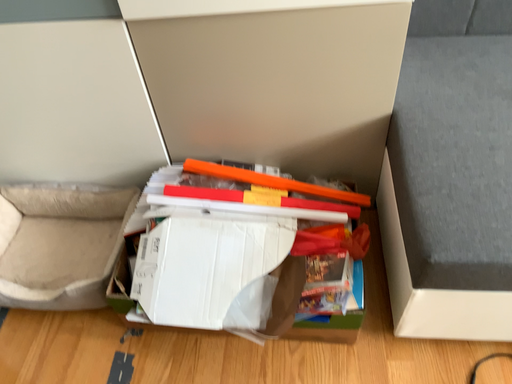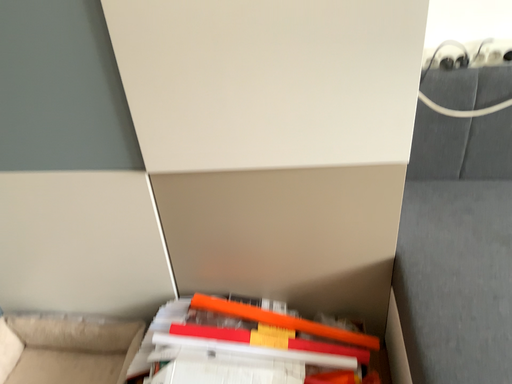
Question: How did the camera likely rotate when shooting the video?

Choices:
 (A) rotated downward
 (B) rotated upward

Answer: (B)